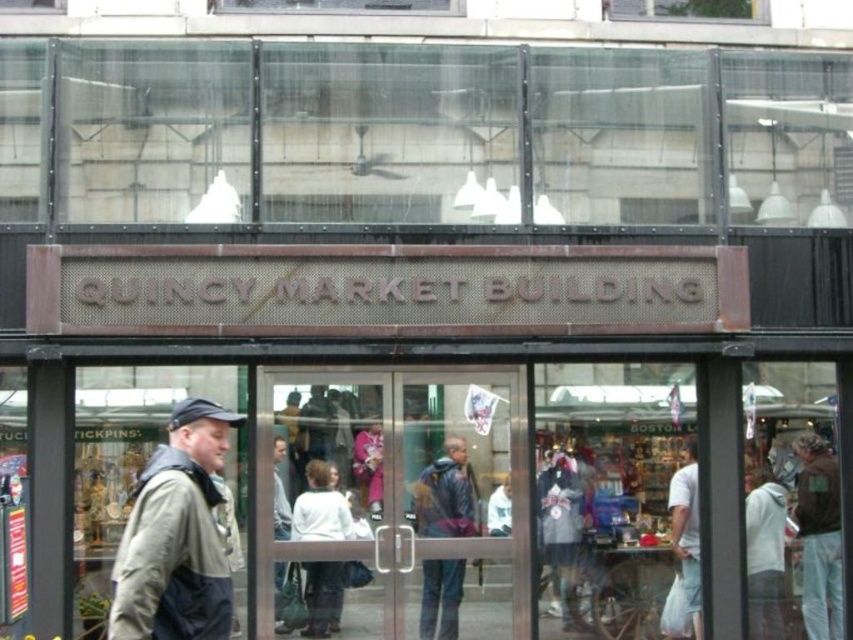
Can you confirm if transparent glass door at center is shorter than white cotton t-shirt at center?

No, transparent glass door at center is not shorter than white cotton t-shirt at center.

Is point (476, 534) in front of point (675, 476)?

Yes, point (476, 534) is closer to viewer.

Measure the distance between point [462,497] and camera.

Point [462,497] and camera are 30.33 feet apart from each other.

You are a GUI agent. You are given a task and a screenshot of the screen. Output one action in this format:
    pyautogui.click(x=<x>, y=<y>)
    Task: Click on the transparent glass door at center
    The image size is (853, 640).
    Given the screenshot: What is the action you would take?
    pyautogui.click(x=418, y=493)

Is transparent glass door at center thinner than light brown leather jacket at right?

In fact, transparent glass door at center might be wider than light brown leather jacket at right.

This screenshot has width=853, height=640. Describe the element at coordinates (418, 493) in the screenshot. I see `transparent glass door at center` at that location.

At what (x,y) coordinates should I click in order to perform the action: click on transparent glass door at center. Please return your answer as a coordinate pair (x, y). Looking at the image, I should click on (418, 493).

Is light brown leather jacket at right shorter than matte blue jacket at center?

No.

Is light brown leather jacket at right below matte blue jacket at center?

Indeed, light brown leather jacket at right is positioned under matte blue jacket at center.

Is point (827, 627) farther from camera compared to point (419, 612)?

Yes, it is.

Find the location of `light brown leather jacket at right`. light brown leather jacket at right is located at coordinates (819, 538).